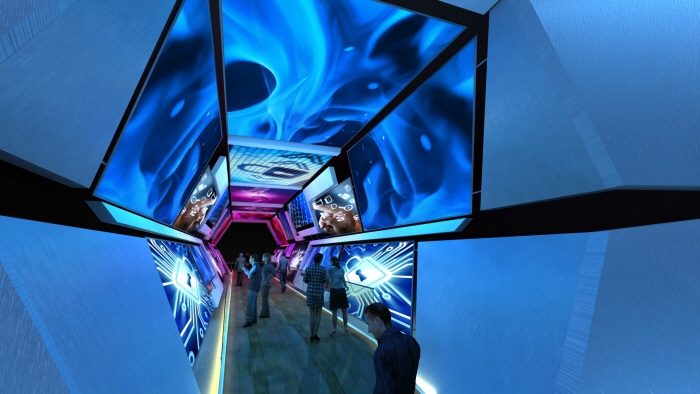
What are the coordinates of `right side wall` in the screenshot? It's located at (122, 307).